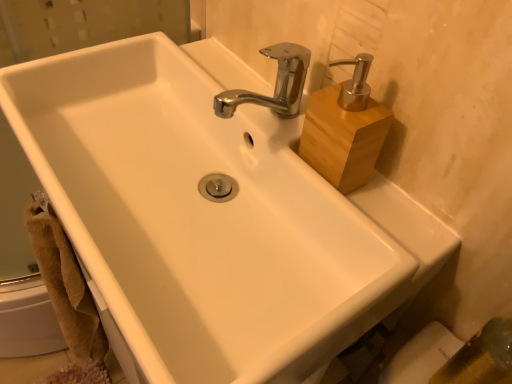
Describe the element at coordinates (345, 129) in the screenshot. I see `wooden block at upper right` at that location.

Locate an element on the screen. This screenshot has height=384, width=512. wooden block at upper right is located at coordinates (345, 129).

At what (x,y) coordinates should I click in order to perform the action: click on wooden block at upper right. Please return your answer as a coordinate pair (x, y). The height and width of the screenshot is (384, 512). Looking at the image, I should click on (345, 129).